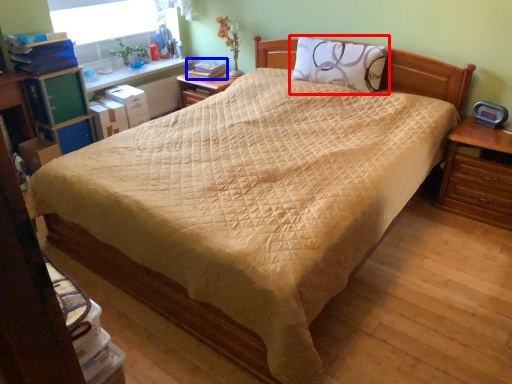
Question: Among these objects, which one is farthest to the camera, pillow (highlighted by a red box) or book (highlighted by a blue box)?

Choices:
 (A) pillow
 (B) book

Answer: (B)